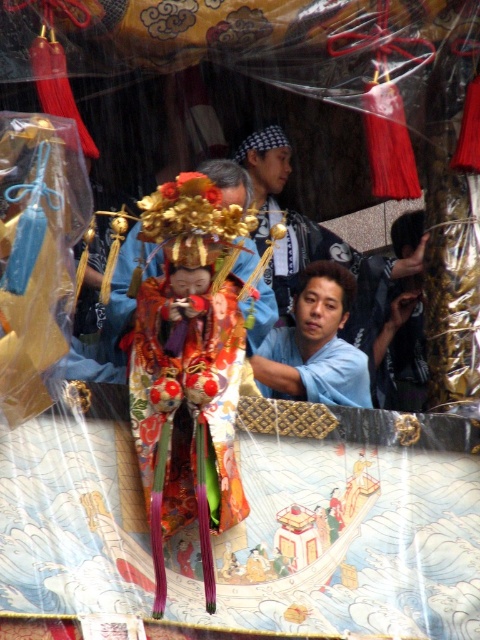
You are an artist trying to sketch the scene. You need to place the blue cotton shirt at center accurately. According to the coordinates provided, where should you position it on your drawing canvas?

The blue cotton shirt at center should be positioned at the coordinates point [356,294] on the drawing canvas.

You are an assistant helping to prepare for a traditional Japanese festival. You notice two shirts, a blue cotton shirt at center and a matte blue shirt at center, placed on a display platform. Which shirt is visible on top?

The blue cotton shirt at center is positioned over the matte blue shirt at center, so the blue cotton shirt at center is visible on top.

You are an observer standing in front of the festival scene. You notice a point marked at coordinates (356, 294). What object is located at that point?

The point at coordinates (356, 294) marks the blue cotton shirt at center.